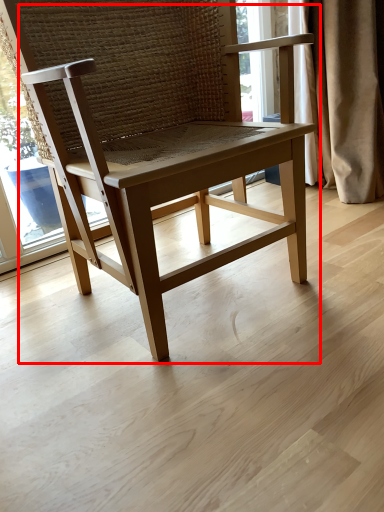
Question: Where is chair (annotated by the red box) located in relation to curtain in the image?

Choices:
 (A) left
 (B) right

Answer: (A)